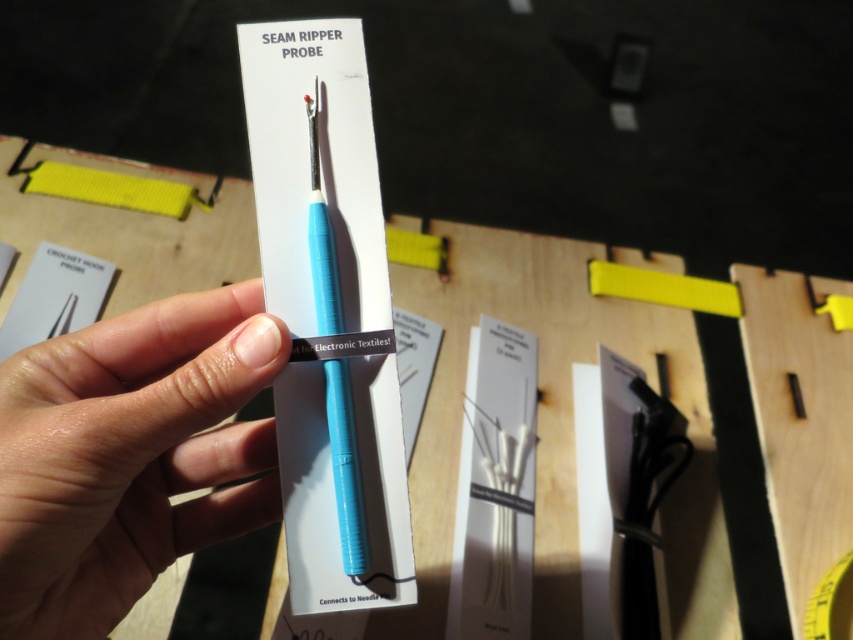
You are a craftsperson working in a workshop. You need to choose between the blue plastic seam ripper probe at center and the yellow matte tape measure at center for a task that requires a taller tool. Which one should you pick?

The blue plastic seam ripper probe at center is much taller than the yellow matte tape measure at center, so you should pick the blue plastic seam ripper probe at center for the task that requires a taller tool.

You are an engineer working in a workshop and need to determine the placement of tools. Based on the image, which object is shorter between the light skin tone flesh at center and the blue plastic seam ripper probe at center?

The light skin tone flesh at center is shorter than the blue plastic seam ripper probe at center according to the description.

From the picture: You are a robotic arm trying to pick up the blue plastic seam ripper probe at center from the table. There is a light skin tone flesh at center touching it. Can you safely pick up the probe without moving the hand?

The light skin tone flesh at center is wider than the blue plastic seam ripper probe at center. Since the hand is wider, it is covering part of the probe. You might need to gently move the hand out of the way before picking up the probe to avoid causing any disturbance.